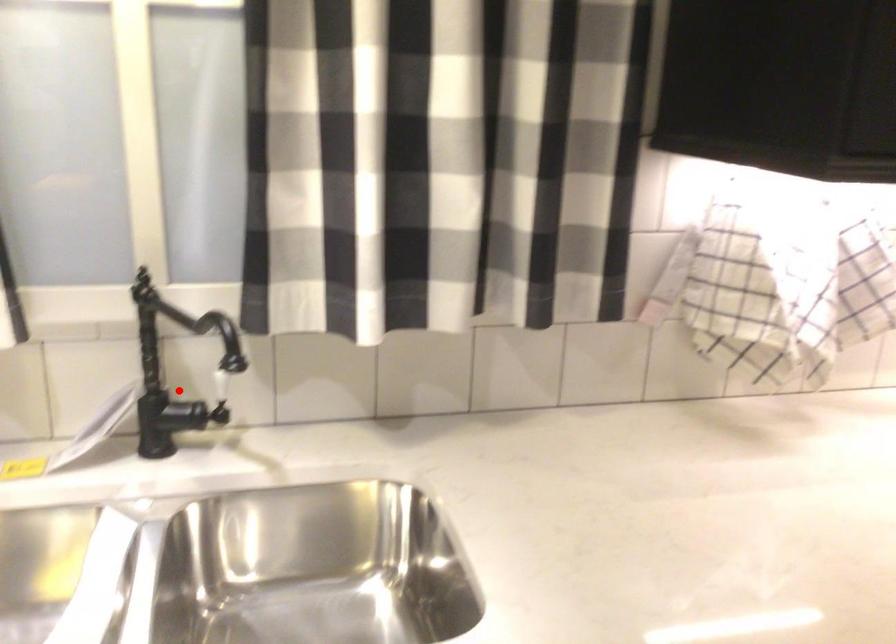
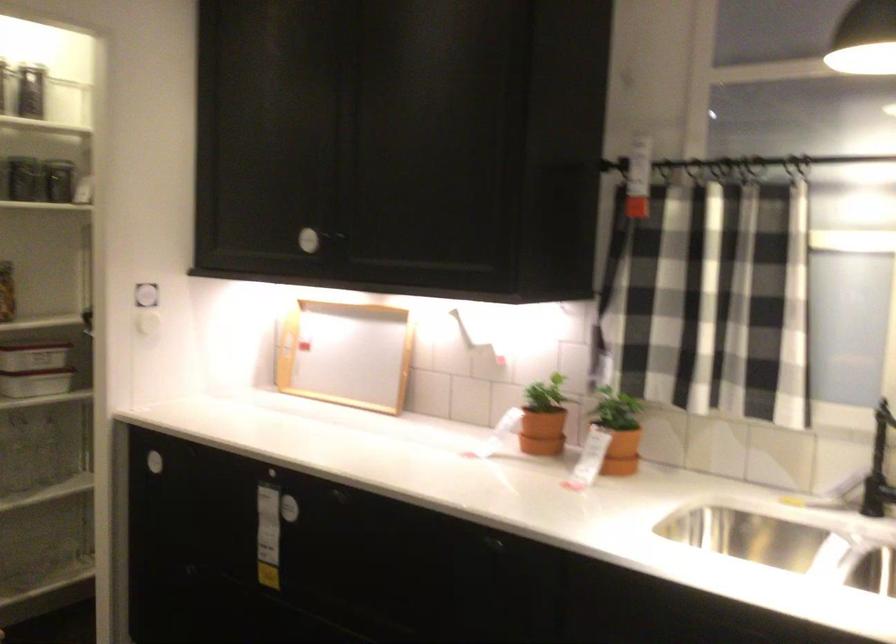
Question: I am providing you with two images of the same scene from different viewpoints. A red point is shown in image1. For the corresponding object point in image2, is it positioned nearer or farther from the camera?

Choices:
 (A) Nearer
 (B) Farther

Answer: (B)